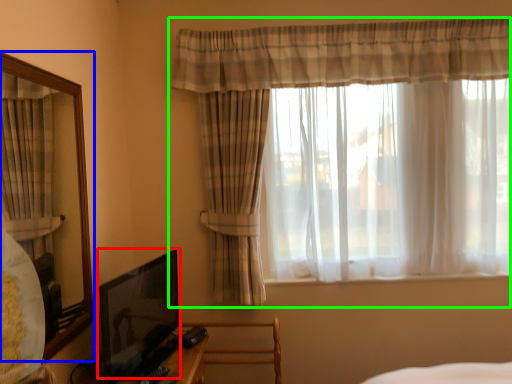
Question: Based on their relative distances, which object is farther from picture frame (highlighted by a red box)? Choose from mirror (highlighted by a blue box) and curtain (highlighted by a green box).

Choices:
 (A) mirror
 (B) curtain

Answer: (B)